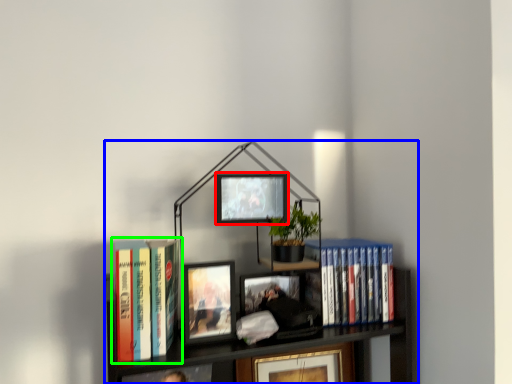
Question: Based on their relative distances, which object is farther from picture frame (highlighted by a red box)? Choose from bookcase (highlighted by a blue box) and book (highlighted by a green box).

Choices:
 (A) bookcase
 (B) book

Answer: (B)